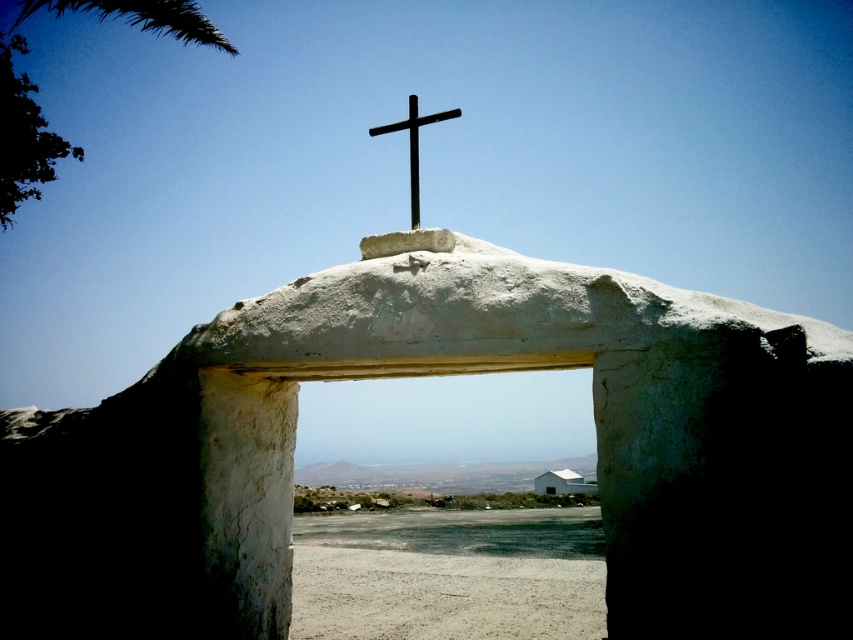
You are standing at the base of the green leafy palm tree at upper left and want to walk straight towards the black metal cross at center. How far will you have to walk?

The green leafy palm tree at upper left is 95.25 feet away from the black metal cross at center, so you will have to walk 95.25 feet to reach it.